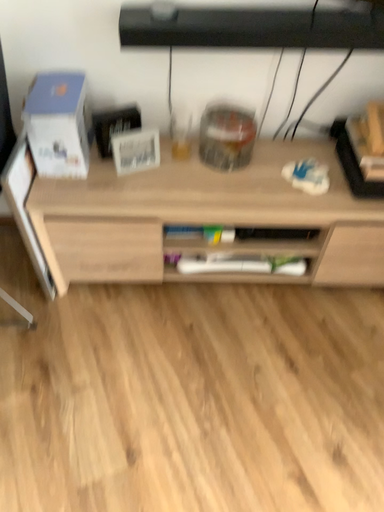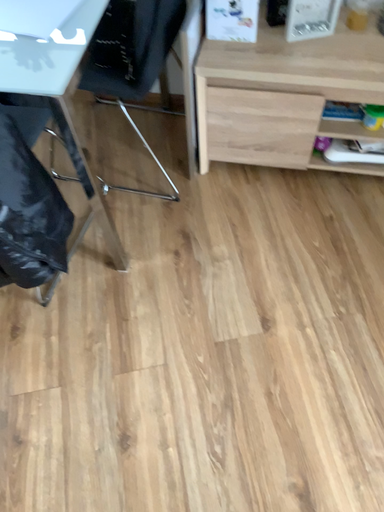
Question: How did the camera likely rotate when shooting the video?

Choices:
 (A) rotated left
 (B) rotated right

Answer: (A)